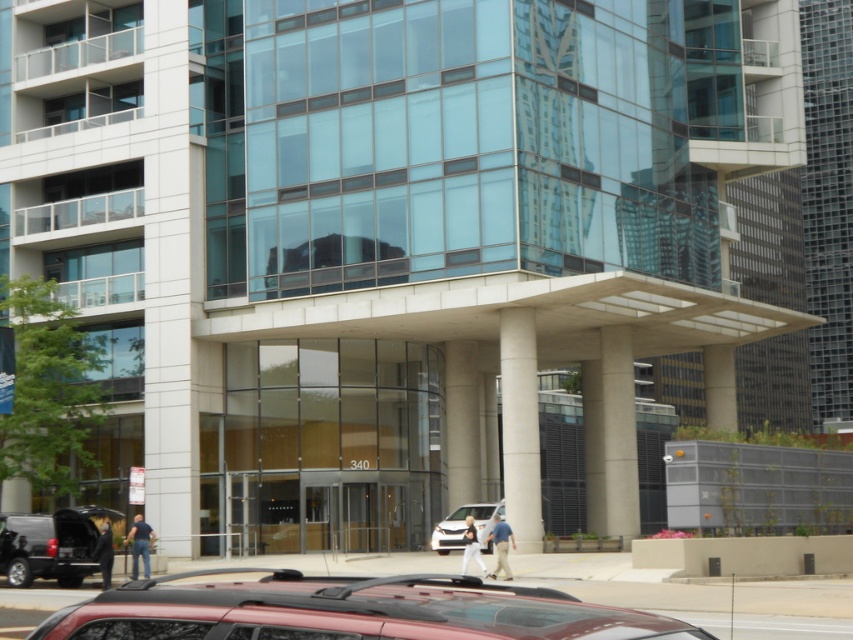
Is white marble pillar at center shorter than black matte suv at lower left?

No.

Can you confirm if white marble pillar at center is taller than black matte suv at lower left?

Yes.

Who is more distant from viewer, (503, 412) or (1, 552)?

Positioned behind is point (503, 412).

Identify the location of white marble pillar at center. The height and width of the screenshot is (640, 853). (520, 426).

Describe the element at coordinates (50, 545) in the screenshot. This screenshot has height=640, width=853. I see `black matte suv at lower left` at that location.

Find the location of `black matte suv at lower left`. black matte suv at lower left is located at coordinates (50, 545).

Between shiny red suv at lower center and white matte van at center, which one has more height?

shiny red suv at lower center

Is shiny red suv at lower center to the left of white matte van at center from the viewer's perspective?

Yes, shiny red suv at lower center is to the left of white matte van at center.

Is point (219, 620) in front of point (466, 509)?

That is True.

The width and height of the screenshot is (853, 640). Identify the location of shiny red suv at lower center. (347, 611).